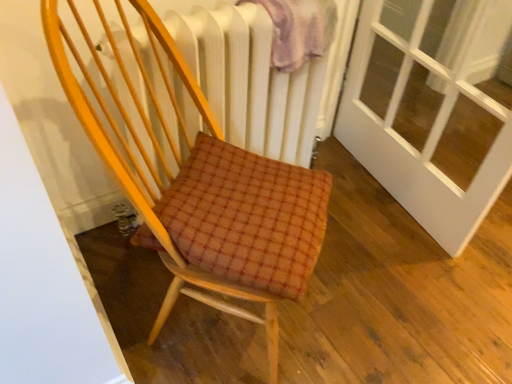
Question: From the image's perspective, relative to white textured radiator at upper center, is wooden chair at center above or below?

Choices:
 (A) below
 (B) above

Answer: (A)

Question: Looking at the image, does wooden chair at center seem bigger or smaller compared to white textured radiator at upper center?

Choices:
 (A) big
 (B) small

Answer: (A)

Question: Estimate the real-world distances between objects in this image. Which object is closer to the wooden chair at center?

Choices:
 (A) plush pink blanket at upper center
 (B) white textured radiator at upper center

Answer: (B)

Question: Which is farther from the wooden chair at center?

Choices:
 (A) plush pink blanket at upper center
 (B) white textured radiator at upper center

Answer: (A)